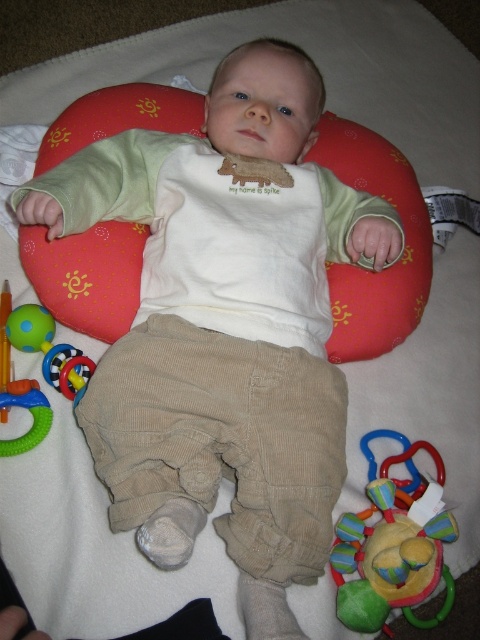
Which is above, red fabric bean bag chair at center or multicolored fabric rattle at lower right?

red fabric bean bag chair at center is above.

Between point (120, 316) and point (345, 580), which one is positioned behind?

The point (120, 316) is more distant.

You are a GUI agent. You are given a task and a screenshot of the screen. Output one action in this format:
    pyautogui.click(x=<x>, y=<y>)
    Task: Click on the red fabric bean bag chair at center
    
    Given the screenshot: What is the action you would take?
    pyautogui.click(x=363, y=268)

Is red fabric bean bag chair at center shorter than rubberized plastic rattle at lower left?

No, red fabric bean bag chair at center is not shorter than rubberized plastic rattle at lower left.

Is point (57, 268) farther from viewer compared to point (32, 428)?

Yes, it is behind point (32, 428).

At what (x,y) coordinates should I click in order to perform the action: click on red fabric bean bag chair at center. Please return your answer as a coordinate pair (x, y). Looking at the image, I should click on (363, 268).

I want to click on red fabric bean bag chair at center, so click(363, 268).

Between point (388, 564) and point (14, 392), which one is positioned behind?

Point (14, 392)

Is point (395, 512) closer to viewer compared to point (4, 384)?

That is True.

Who is more forward, (371, 620) or (28, 307)?

Point (371, 620) is more forward.

The height and width of the screenshot is (640, 480). I want to click on multicolored fabric rattle at lower right, so click(392, 557).